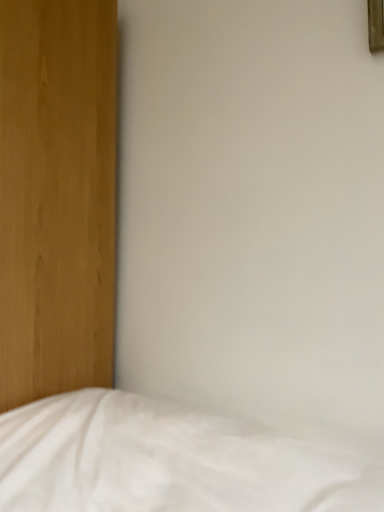
Question: In terms of size, does white soft bed at lower left appear bigger or smaller than wooden picture frame at upper right?

Choices:
 (A) big
 (B) small

Answer: (A)

Question: Do you think white soft bed at lower left is within wooden picture frame at upper right, or outside of it?

Choices:
 (A) outside
 (B) inside

Answer: (A)

Question: Is white soft bed at lower left in front of or behind wooden picture frame at upper right in the image?

Choices:
 (A) front
 (B) behind

Answer: (A)

Question: In the image, is wooden picture frame at upper right positioned in front of or behind white soft bed at lower left?

Choices:
 (A) front
 (B) behind

Answer: (B)

Question: From a real-world perspective, is wooden picture frame at upper right physically located above or below white soft bed at lower left?

Choices:
 (A) above
 (B) below

Answer: (A)

Question: Looking at the image, does wooden picture frame at upper right seem bigger or smaller compared to white soft bed at lower left?

Choices:
 (A) small
 (B) big

Answer: (A)

Question: Is point (377, 50) closer or farther from the camera than point (213, 458)?

Choices:
 (A) farther
 (B) closer

Answer: (A)